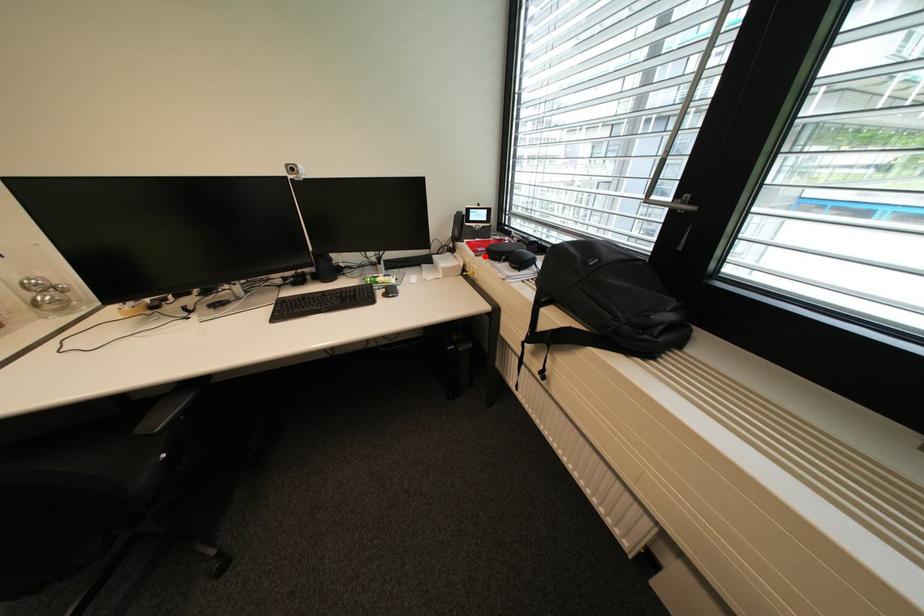
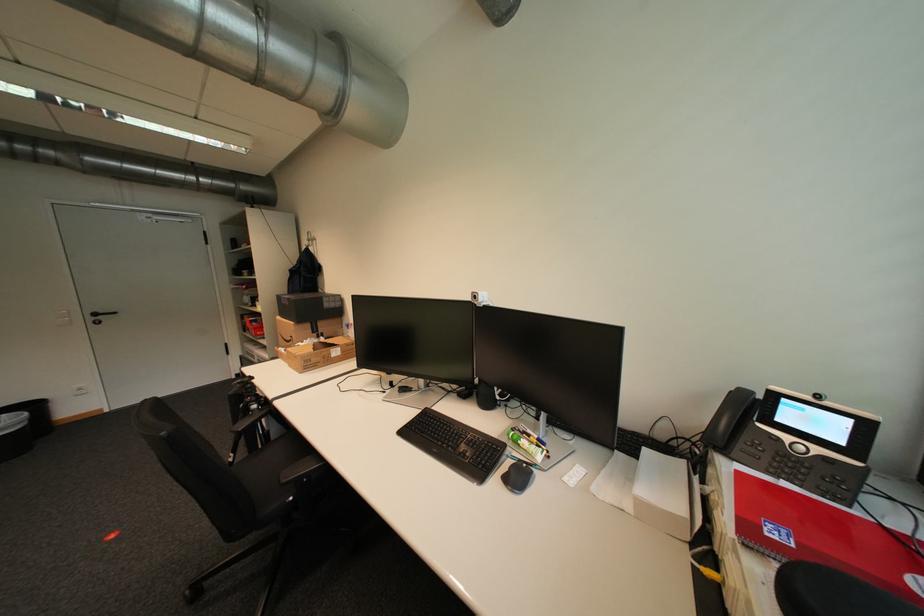
Locate, in the second image, the point that corresponds to the highlighted location in the first image.

(754, 545)